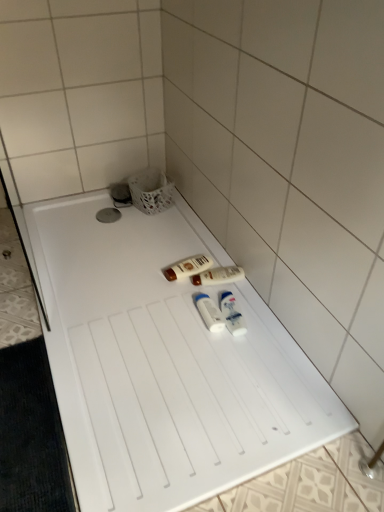
Identify the location of free space in front of matte brown lotion at center, placed as the first toiletry when sorted from back to front. The width and height of the screenshot is (384, 512). (170, 302).